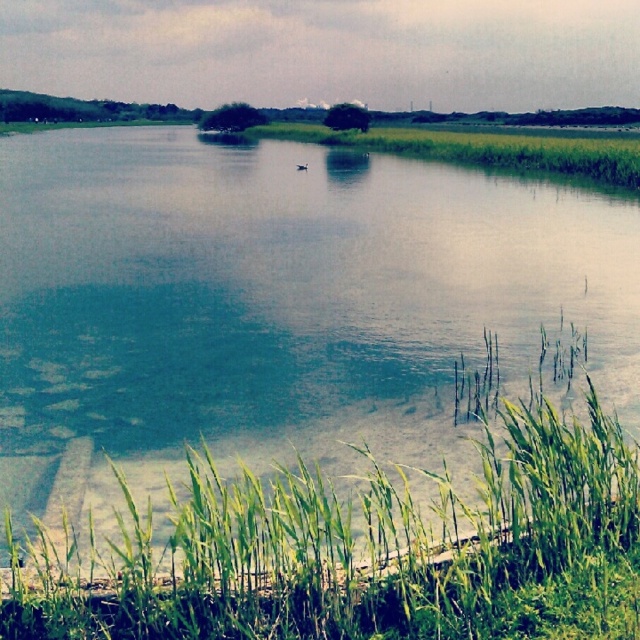
You are standing at the edge of the water and want to step onto the green grass at lower right. Which direction should you move relative to the clear water at center?

You should move to the right of the clear water at center to reach the green grass at lower right.

You are standing at the edge of the water and want to walk towards the green grass at center. Which direction should you move to reach it without stepping into the clear water at center?

You should move to the right because the green grass at center is to the right of the clear water at center, so moving right will take you towards the grass while avoiding the water.